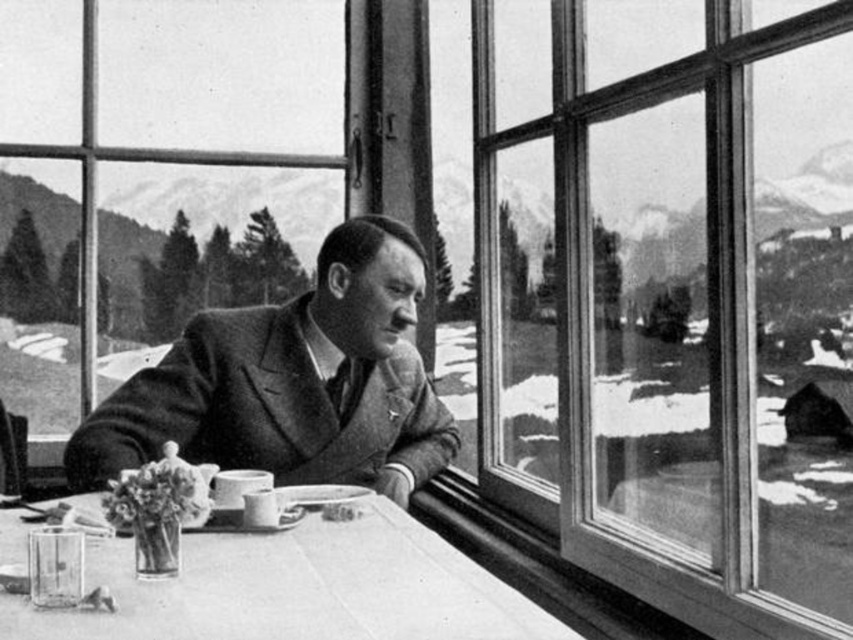
You are standing in the room where the man is seated. You want to place a small plant on the table such that it is exactly 2 meters away from you. Given the table has a point at coordinates point (339, 480), can you determine if placing the plant there would meet your requirement?

The distance of point (339, 480) from viewer is 2.27 meters, so placing the plant at that point would be 0.27 meters further away than desired. Choose a closer spot on the table instead.

You are a tailor observing the man in the scene. You need to determine if the smooth woolen suit at center can be placed on the smooth wooden table at center without any part of the suit hanging off the table. Can you confirm if this is possible?

The smooth woolen suit at center is taller than smooth wooden table at center, so placing the suit on the table would cause part of it to hang off since the table is shorter in height than the suit.

The man in the image is wearing a suit. There is a point at coordinates (292,381). Based on the scene description, where is this point located on the man?

The point at coordinates (292,381) is located on the smooth woolen suit at center.